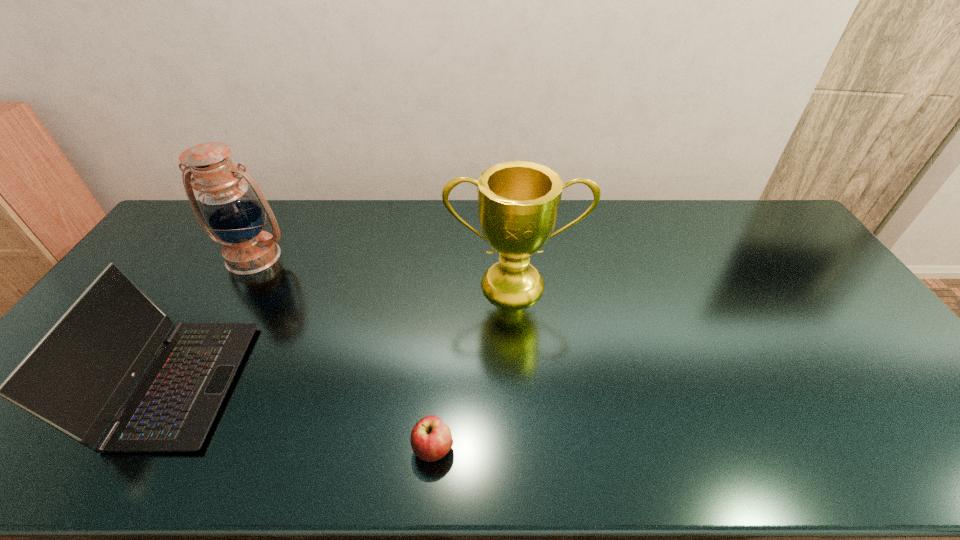
The height and width of the screenshot is (540, 960). I want to click on vacant space that satisfies the following two spatial constraints: 1. on the screen of the shortest object; 2. on the left side of the third tallest object, so click(142, 448).

In order to click on vacant space that satisfies the following two spatial constraints: 1. on the back side of the shortest object; 2. on the screen of the third tallest object in this screenshot , I will do `click(439, 383)`.

Image resolution: width=960 pixels, height=540 pixels. I want to click on free spot that satisfies the following two spatial constraints: 1. on the shiny surface of the award; 2. on the screen of the second shortest object, so click(x=523, y=383).

The image size is (960, 540). What are the coordinates of `vacant space that satisfies the following two spatial constraints: 1. on the screen of the shortest object; 2. on the left side of the laptop computer` in the screenshot? It's located at (142, 448).